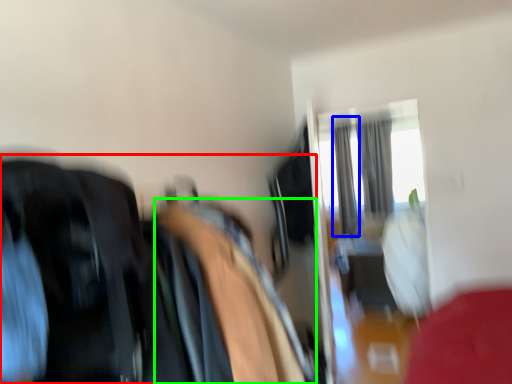
Question: Which is nearer to the laundry (highlighted by a red box)? curtain (highlighted by a blue box) or bean bag chair (highlighted by a green box).

Choices:
 (A) curtain
 (B) bean bag chair

Answer: (B)